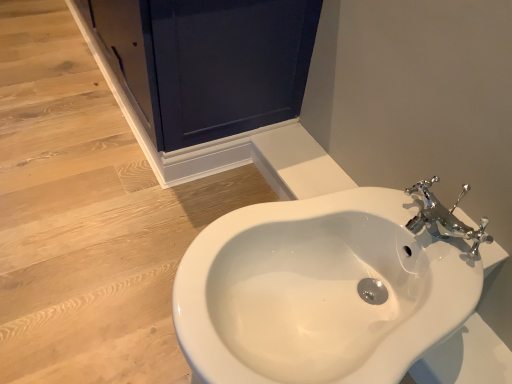
Image resolution: width=512 pixels, height=384 pixels. Identify the location of white glossy sink at center. (319, 291).

What is the approximate width of white glossy sink at center?

22.84 inches.

What do you see at coordinates (319, 291) in the screenshot? I see `white glossy sink at center` at bounding box center [319, 291].

In order to face white glossy sink at center, should I rotate leftwards or rightwards?

A 7.166 degree turn to the right will do.

What is the approximate width of matte dark blue screen door at upper left?

22.40 inches.

What do you see at coordinates (229, 64) in the screenshot? The width and height of the screenshot is (512, 384). I see `matte dark blue screen door at upper left` at bounding box center [229, 64].

In order to click on matte dark blue screen door at upper left in this screenshot , I will do `click(229, 64)`.

Identify the location of white glossy sink at center. (319, 291).

Between white glossy sink at center and matte dark blue screen door at upper left, which one appears on the right side from the viewer's perspective?

Positioned to the right is white glossy sink at center.

Which object is closer to the camera taking this photo, white glossy sink at center or matte dark blue screen door at upper left?

white glossy sink at center is in front.

Is point (292, 290) closer or farther from the camera than point (241, 5)?

Clearly, point (292, 290) is closer to the camera than point (241, 5).

From the image's perspective, is white glossy sink at center below matte dark blue screen door at upper left?

Indeed, from the image's perspective, white glossy sink at center is shown beneath matte dark blue screen door at upper left.

From a real-world perspective, who is located lower, white glossy sink at center or matte dark blue screen door at upper left?

white glossy sink at center is physically lower.

Between white glossy sink at center and matte dark blue screen door at upper left, which one has smaller width?

Thinner between the two is matte dark blue screen door at upper left.

Considering the relative sizes of white glossy sink at center and matte dark blue screen door at upper left in the image provided, is white glossy sink at center shorter than matte dark blue screen door at upper left?

Yes.

Does white glossy sink at center have a smaller size compared to matte dark blue screen door at upper left?

Yes, white glossy sink at center is smaller than matte dark blue screen door at upper left.

Is white glossy sink at center positioned beyond the bounds of matte dark blue screen door at upper left?

Yes.

Are white glossy sink at center and matte dark blue screen door at upper left making contact?

No, white glossy sink at center is not making contact with matte dark blue screen door at upper left.

Is white glossy sink at center oriented towards matte dark blue screen door at upper left?

No.

What's the angular difference between white glossy sink at center and matte dark blue screen door at upper left's facing directions?

1.74 degrees.

How far apart are white glossy sink at center and matte dark blue screen door at upper left?

A distance of 25.24 inches exists between white glossy sink at center and matte dark blue screen door at upper left.

Image resolution: width=512 pixels, height=384 pixels. In order to click on sink that is under the matte dark blue screen door at upper left (from a real-world perspective) in this screenshot , I will do `click(319, 291)`.

Which is more to the left, matte dark blue screen door at upper left or white glossy sink at center?

From the viewer's perspective, matte dark blue screen door at upper left appears more on the left side.

Which object is closer to the camera, matte dark blue screen door at upper left or white glossy sink at center?

white glossy sink at center is in front.

Which is behind, point (218, 133) or point (261, 291)?

The point (218, 133) is farther.

From the image's perspective, which one is positioned higher, matte dark blue screen door at upper left or white glossy sink at center?

matte dark blue screen door at upper left.

From a real-world perspective, is matte dark blue screen door at upper left above or below white glossy sink at center?

In terms of real-world spatial position, matte dark blue screen door at upper left is above white glossy sink at center.

Considering the sizes of objects matte dark blue screen door at upper left and white glossy sink at center in the image provided, who is wider, matte dark blue screen door at upper left or white glossy sink at center?

Wider between the two is white glossy sink at center.

Which of these two, matte dark blue screen door at upper left or white glossy sink at center, stands shorter?

Standing shorter between the two is white glossy sink at center.

Considering the sizes of objects matte dark blue screen door at upper left and white glossy sink at center in the image provided, who is bigger, matte dark blue screen door at upper left or white glossy sink at center?

With larger size is matte dark blue screen door at upper left.

Is matte dark blue screen door at upper left positioned beyond the bounds of white glossy sink at center?

Yes, matte dark blue screen door at upper left is outside of white glossy sink at center.

Is matte dark blue screen door at upper left positioned far away from white glossy sink at center?

They are positioned close to each other.

Is matte dark blue screen door at upper left positioned with its back to white glossy sink at center?

No.

What are the coordinates of `screen door lying above the white glossy sink at center (from the image's perspective)` in the screenshot? It's located at (229, 64).

Identify the location of sink in front of the matte dark blue screen door at upper left. (319, 291).

Identify the location of sink on the right of matte dark blue screen door at upper left. The image size is (512, 384). (319, 291).